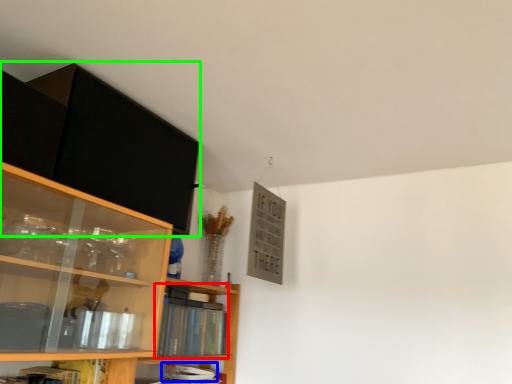
Question: Which object is positioned farthest from book (highlighted by a red box)? Select from book (highlighted by a blue box) and cabinetry (highlighted by a green box).

Choices:
 (A) book
 (B) cabinetry

Answer: (B)